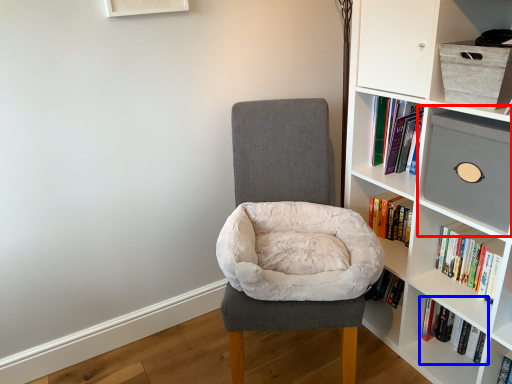
Question: Which object appears closest to the camera in this image, shelf (highlighted by a red box) or book (highlighted by a blue box)?

Choices:
 (A) shelf
 (B) book

Answer: (A)